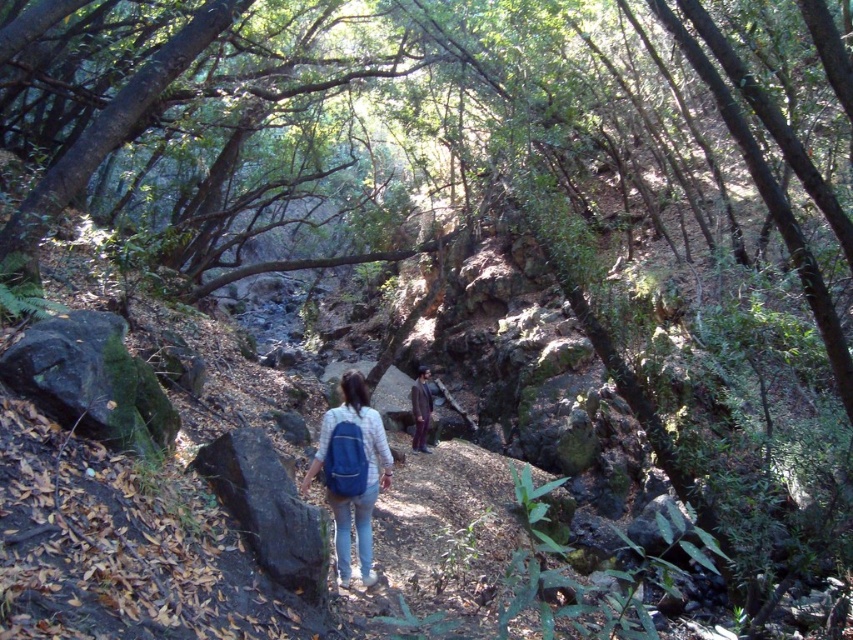
Question: From the image, what is the correct spatial relationship of blue fabric backpack at center in relation to dark brown suit at center?

Choices:
 (A) below
 (B) above

Answer: (B)

Question: Does black rough rock at center have a larger size compared to blue fabric backpack at center?

Choices:
 (A) no
 (B) yes

Answer: (A)

Question: Which of the following is the closest to the observer?

Choices:
 (A) (419, 376)
 (B) (299, 541)
 (C) (344, 520)

Answer: (B)

Question: Observing the image, what is the correct spatial positioning of black rough rock at center in reference to blue fabric backpack at center?

Choices:
 (A) left
 (B) right

Answer: (A)

Question: Which object appears farthest from the camera in this image?

Choices:
 (A) black rough rock at center
 (B) blue fabric backpack at center

Answer: (B)

Question: Estimate the real-world distances between objects in this image. Which object is closer to the black rough rock at center?

Choices:
 (A) blue fabric backpack at center
 (B) dark brown suit at center

Answer: (A)